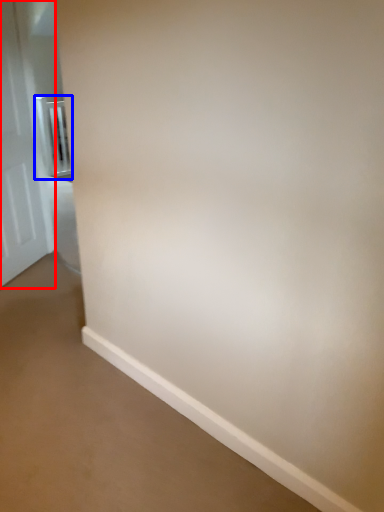
Question: Which point is further to the camera, door (highlighted by a red box) or balustrade (highlighted by a blue box)?

Choices:
 (A) door
 (B) balustrade

Answer: (B)